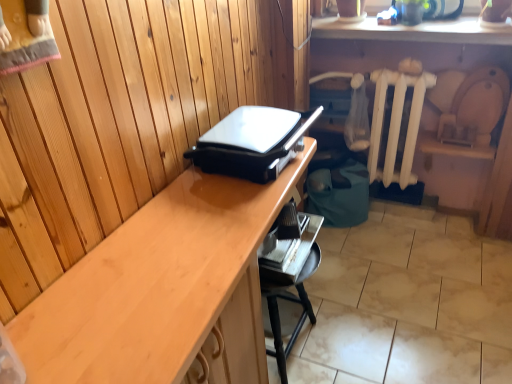
Question: From a real-world perspective, is white painted wood radiator at center right above or below black plastic grill at center?

Choices:
 (A) above
 (B) below

Answer: (B)

Question: Visually, is white painted wood radiator at center right positioned to the left or to the right of black plastic grill at center?

Choices:
 (A) right
 (B) left

Answer: (A)

Question: Based on their relative distances, which object is farther from the black plastic grill at center?

Choices:
 (A) metallic silver tray at lower center
 (B) white painted wood radiator at center right
 (C) wooden desk at center

Answer: (B)

Question: Estimate the real-world distances between objects in this image. Which object is closer to the black plastic grill at center?

Choices:
 (A) metallic silver tray at lower center
 (B) wooden desk at center
 (C) white painted wood radiator at center right

Answer: (B)